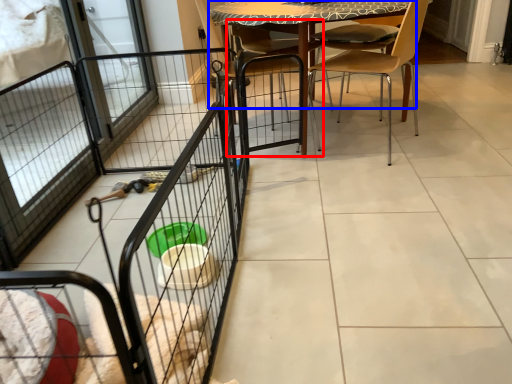
Question: Which of the following is the farthest to the observer, armchair (highlighted by a red box) or table (highlighted by a blue box)?

Choices:
 (A) armchair
 (B) table

Answer: (A)